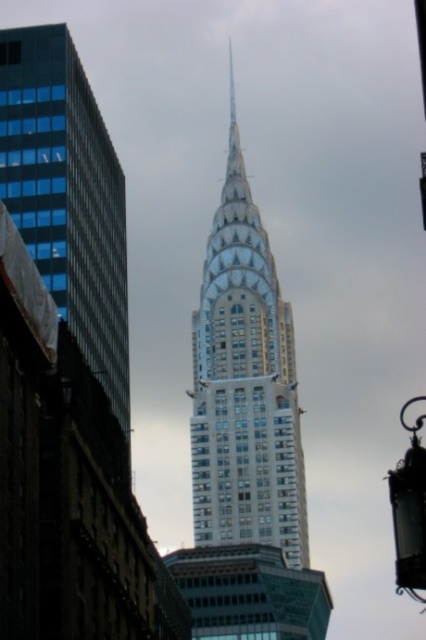
Question: Is glassy steel skyscraper at center thinner than glassy blue skyscraper at left?

Choices:
 (A) no
 (B) yes

Answer: (A)

Question: Does glassy steel skyscraper at center have a smaller size compared to glassy blue skyscraper at left?

Choices:
 (A) yes
 (B) no

Answer: (B)

Question: Which object is farther from the camera taking this photo?

Choices:
 (A) glassy blue skyscraper at left
 (B) glassy steel skyscraper at center

Answer: (B)

Question: Which of the following is the farthest from the observer?

Choices:
 (A) glassy blue skyscraper at left
 (B) glassy steel skyscraper at center

Answer: (B)

Question: Which of the following is the farthest from the observer?

Choices:
 (A) glassy blue skyscraper at left
 (B) glassy steel skyscraper at center

Answer: (B)

Question: From the image, what is the correct spatial relationship of glassy steel skyscraper at center in relation to glassy blue skyscraper at left?

Choices:
 (A) below
 (B) above

Answer: (B)